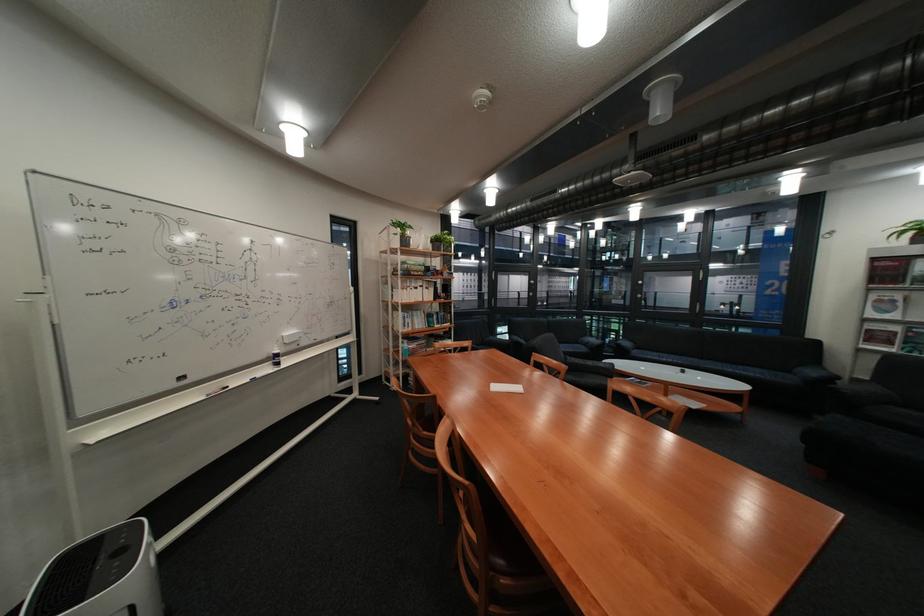
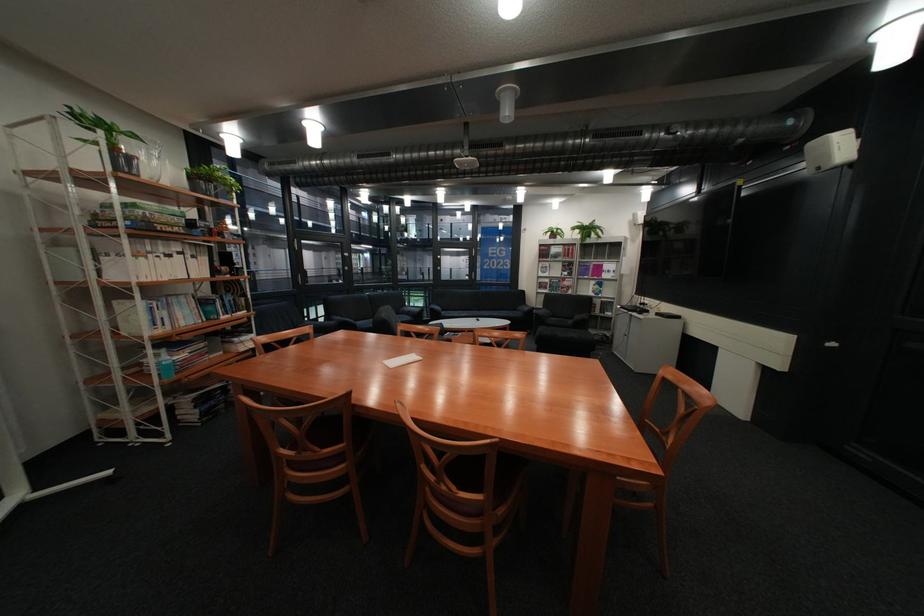
The point at (686, 360) is marked in the first image. Where is the corresponding point in the second image?

(481, 315)